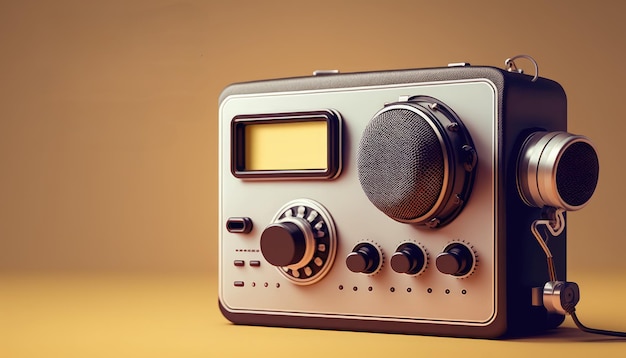
This screenshot has height=358, width=626. What are the coordinates of `speaker` in the screenshot? It's located at (392, 181).